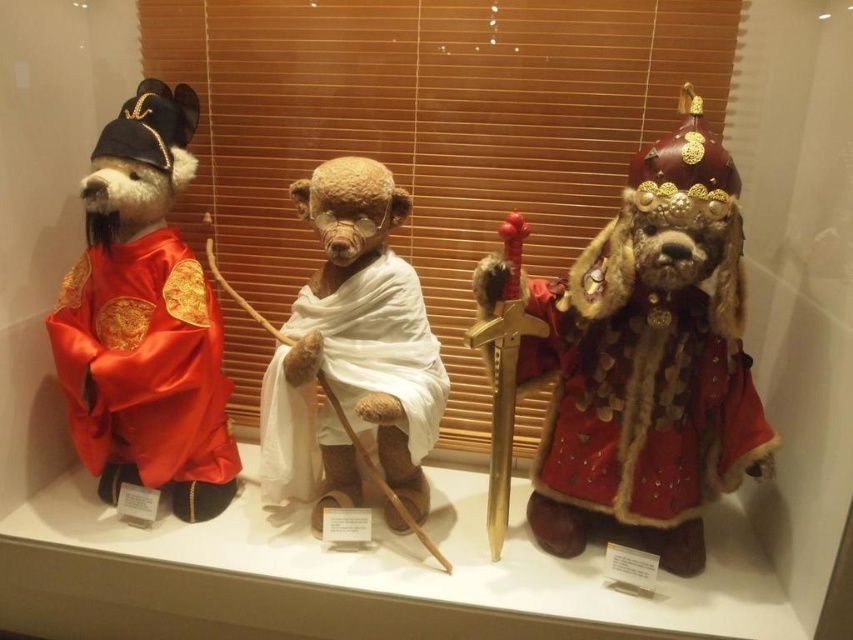
Can you confirm if velvet red bear at center is smaller than fuzzy red coat at center?

No.

Describe the element at coordinates (648, 362) in the screenshot. This screenshot has width=853, height=640. I see `velvet red bear at center` at that location.

Which is in front, point (677, 280) or point (689, 461)?

Point (677, 280) is more forward.

This screenshot has height=640, width=853. In order to click on velvet red bear at center in this screenshot , I will do `click(648, 362)`.

Which is above, silky red robe at left or fuzzy red coat at center?

silky red robe at left is higher up.

The width and height of the screenshot is (853, 640). What are the coordinates of `silky red robe at left` in the screenshot? It's located at (144, 320).

Where is `silky red robe at left`? Image resolution: width=853 pixels, height=640 pixels. silky red robe at left is located at coordinates (144, 320).

Can you confirm if velvet red bear at center is positioned below silky red robe at left?

Yes, velvet red bear at center is below silky red robe at left.

Can you confirm if velvet red bear at center is bigger than silky red robe at left?

Yes.

Which is behind, point (660, 225) or point (123, 400)?

Point (123, 400)

This screenshot has width=853, height=640. I want to click on velvet red bear at center, so click(648, 362).